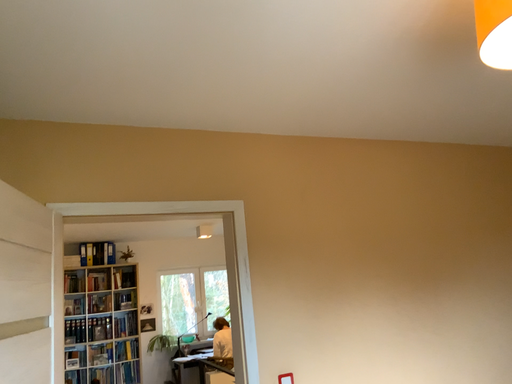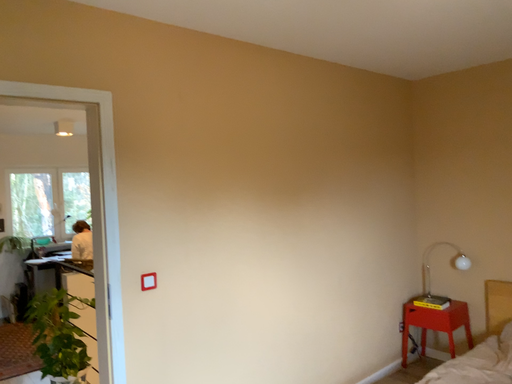
Question: Which way did the camera rotate in the video?

Choices:
 (A) rotated upward
 (B) rotated downward

Answer: (B)